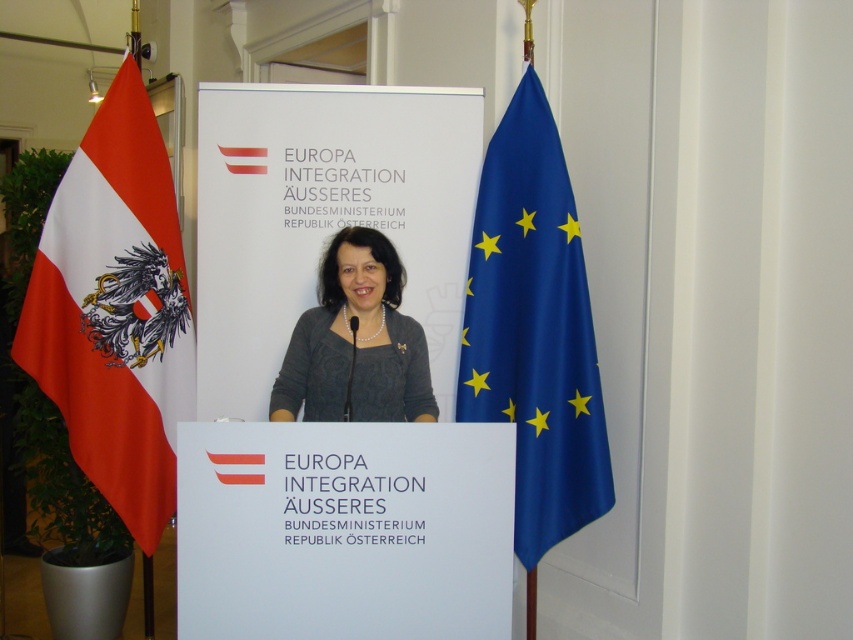
Which is above, red fabric flag at left or blue satin flag at right?

red fabric flag at left is above.

Does point (129, 464) come in front of point (508, 132)?

No, it is behind (508, 132).

This screenshot has width=853, height=640. In order to click on red fabric flag at left in this screenshot , I will do `click(115, 310)`.

Based on the photo, can you confirm if red fabric flag at left is taller than matte gray sweater at center?

Correct, red fabric flag at left is much taller as matte gray sweater at center.

Measure the distance between point (76, 401) and camera.

The distance of point (76, 401) from camera is 9.77 feet.

Who is more distant from viewer, (125, 344) or (352, 304)?

Point (125, 344)

In order to click on red fabric flag at left in this screenshot , I will do `click(115, 310)`.

Does blue satin flag at right appear on the right side of matte gray sweater at center?

Yes, blue satin flag at right is to the right of matte gray sweater at center.

Who is more forward, (596, 369) or (399, 413)?

Point (399, 413) is more forward.

Find the location of a particular element. This screenshot has height=640, width=853. blue satin flag at right is located at coordinates (534, 330).

This screenshot has width=853, height=640. Identify the location of blue satin flag at right. (534, 330).